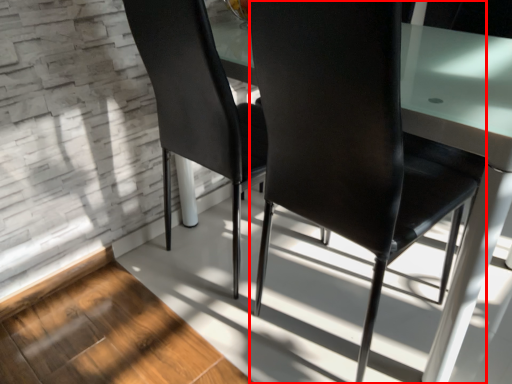
Question: Where is chair (annotated by the red box) located in relation to chair in the image?

Choices:
 (A) left
 (B) right

Answer: (B)